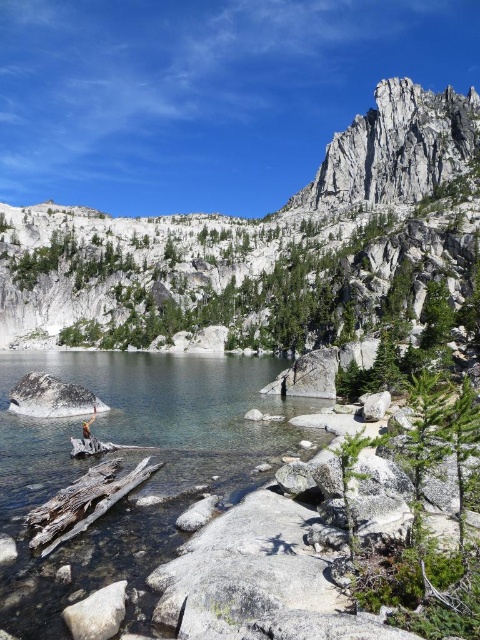
Which of these two, gray granite rock at center or gray granite rock at lower right, stands shorter?

gray granite rock at lower right

Consider the image. Is gray granite rock at center above gray granite rock at lower right?

No, gray granite rock at center is not above gray granite rock at lower right.

Who is more distant from viewer, [34,410] or [384,401]?

Positioned behind is point [34,410].

At what (x,y) coordinates should I click in order to perform the action: click on gray granite rock at center. Please return your answer as a coordinate pair (x, y). The width and height of the screenshot is (480, 640). Looking at the image, I should click on (51, 397).

Can you confirm if gray granite rock at center is thinner than brown leather jacket at center?

No, gray granite rock at center is not thinner than brown leather jacket at center.

Between point (78, 400) and point (93, 445), which one is positioned in front?

Point (93, 445) is more forward.

This screenshot has width=480, height=640. Find the location of `gray granite rock at center`. gray granite rock at center is located at coordinates (51, 397).

Is point (27, 314) more distant than point (88, 436)?

Yes.

Image resolution: width=480 pixels, height=640 pixels. Identify the location of gray/rough rock mountain at upper center. (227, 221).

This screenshot has width=480, height=640. What are the coordinates of `gray/rough rock mountain at upper center` in the screenshot? It's located at (x=227, y=221).

Locate an element on the screen. This screenshot has height=640, width=480. gray/rough rock mountain at upper center is located at coordinates (227, 221).